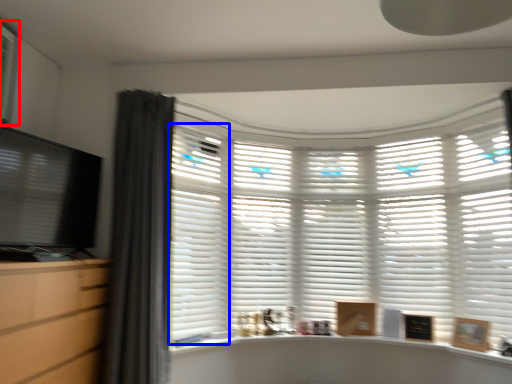
Question: Among these objects, which one is farthest to the camera, air conditioner (highlighted by a red box) or shutter (highlighted by a blue box)?

Choices:
 (A) air conditioner
 (B) shutter

Answer: (B)